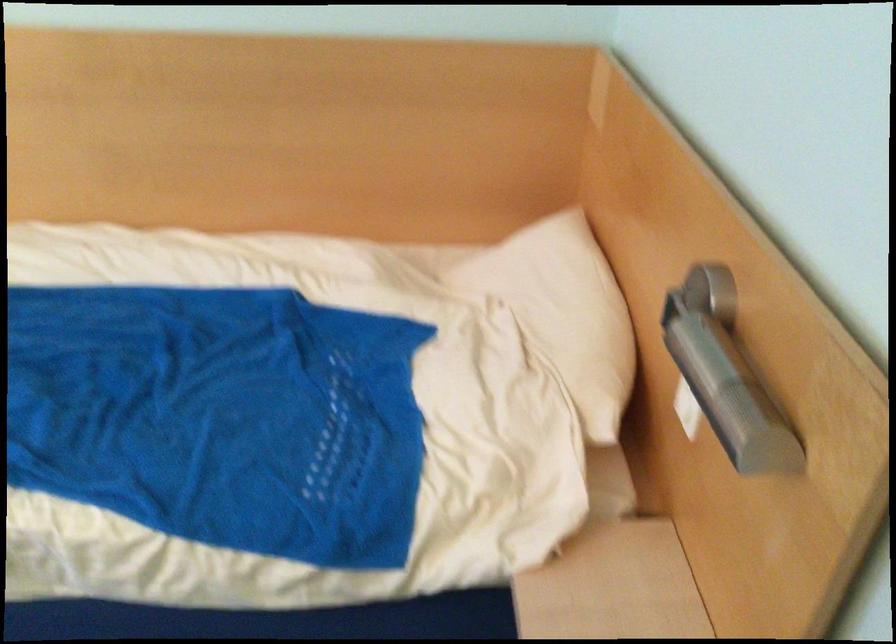
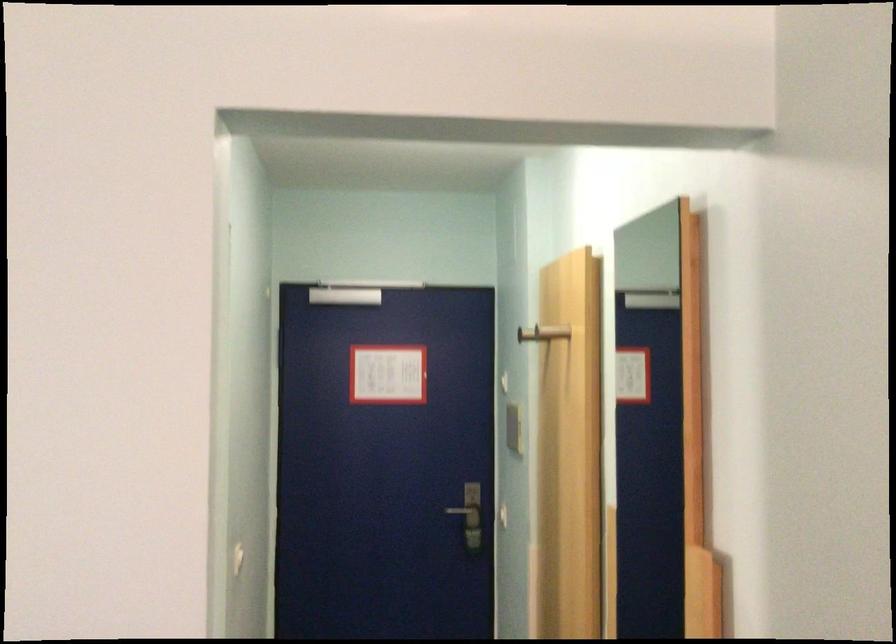
Question: The camera is either moving clockwise (left) or counter-clockwise (right) around the object. The first image is from the beginning of the video and the second image is from the end. Is the camera moving left or right when shooting the video?

Choices:
 (A) Left
 (B) Right

Answer: (A)